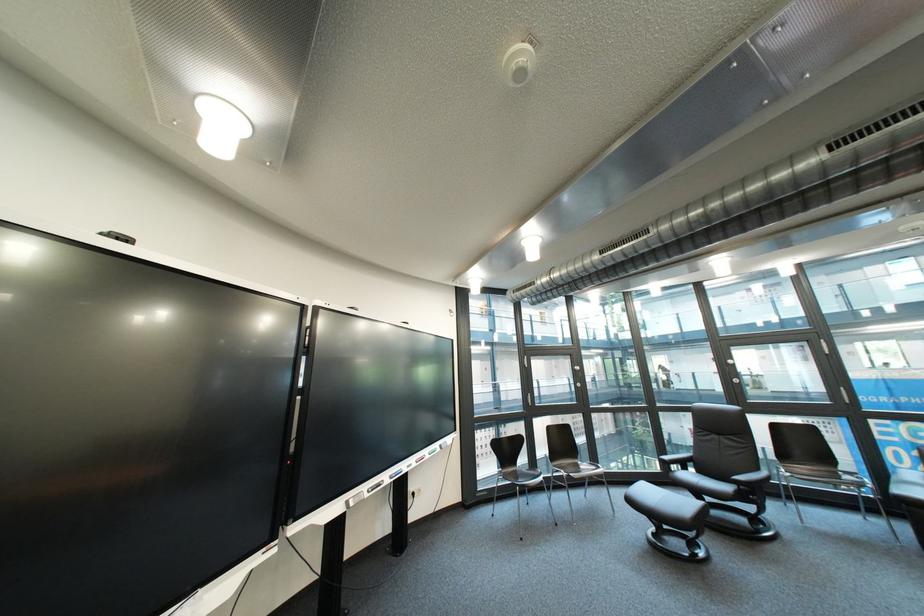
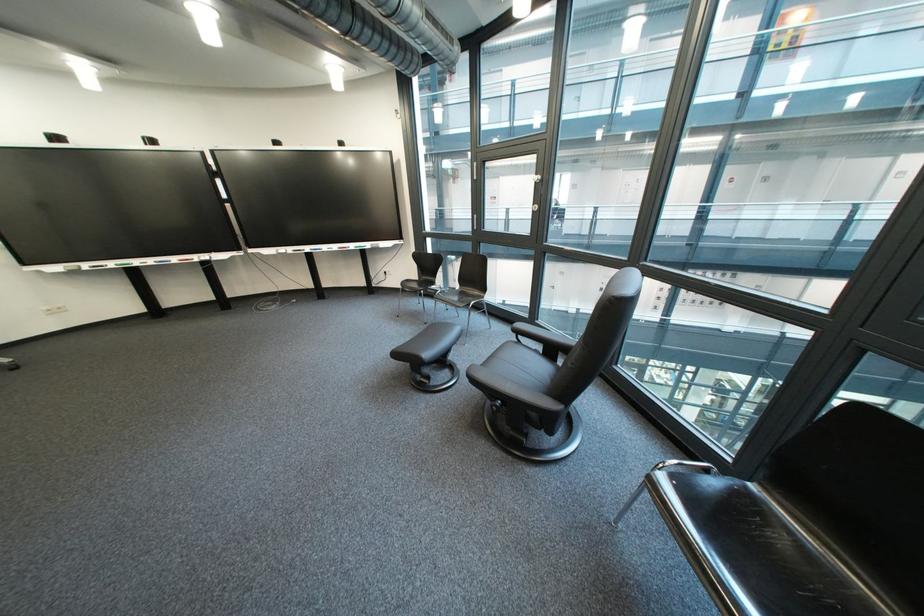
Where in the second image is the point corresponding to point 570,525 from the first image?

(439, 325)